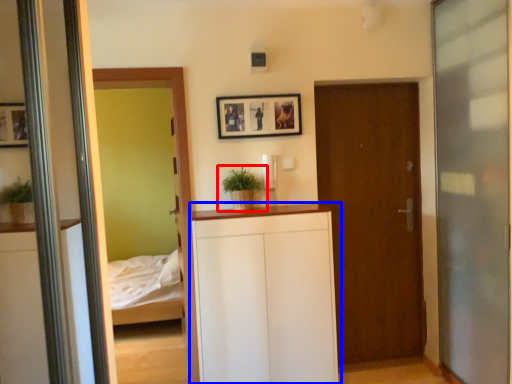
Question: Which object appears closest to the camera in this image, houseplant (highlighted by a red box) or dresser (highlighted by a blue box)?

Choices:
 (A) houseplant
 (B) dresser

Answer: (B)